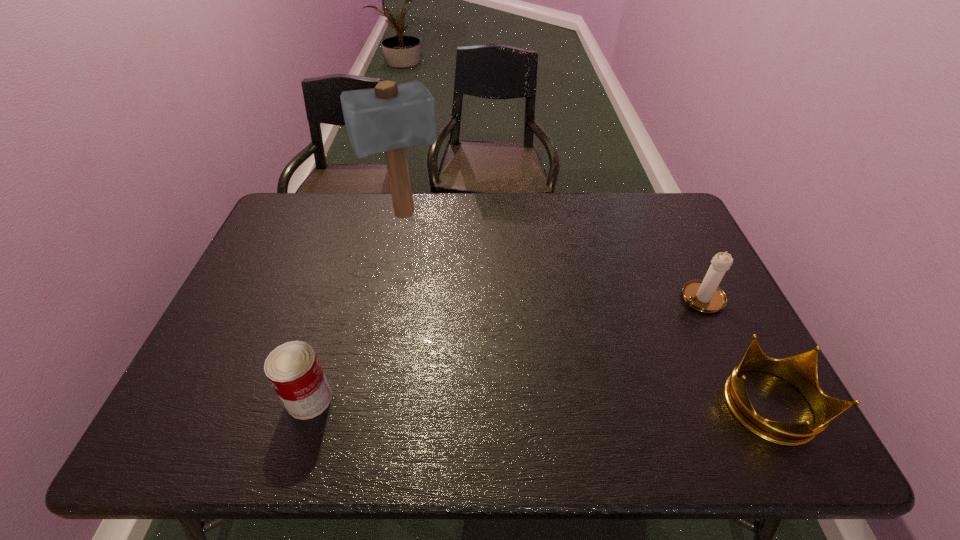
This screenshot has width=960, height=540. Identify the location of unoccupied position between the farthest object and the third nearest object. (552, 257).

Where is `empty space that is in between the farthest object and the crown`? empty space that is in between the farthest object and the crown is located at coordinates (586, 310).

Locate an element on the screen. The width and height of the screenshot is (960, 540). vacant area that lies between the crown and the candle holder is located at coordinates (733, 352).

The height and width of the screenshot is (540, 960). What are the coordinates of `free space that is in between the second farthest object and the shortest object` in the screenshot? It's located at (733, 352).

The image size is (960, 540). Identify the location of free area in between the tallest object and the crown. (586, 310).

You are a GUI agent. You are given a task and a screenshot of the screen. Output one action in this format:
    pyautogui.click(x=<x>, y=<y>)
    Task: Click on the vacant space that is in between the candle holder and the shortest object
    
    Given the screenshot: What is the action you would take?
    pyautogui.click(x=733, y=352)

At what (x,y) coordinates should I click in order to perform the action: click on object that is the third closest to the mallet. Please return your answer as a coordinate pair (x, y). This screenshot has width=960, height=540. Looking at the image, I should click on (800, 370).

Where is `the closest object to the third nearest object`? the closest object to the third nearest object is located at coordinates (800, 370).

Where is `free spot that satisfies the following two spatial constraints: 1. on the front side of the shortest object; 2. on the right side of the third nearest object`? free spot that satisfies the following two spatial constraints: 1. on the front side of the shortest object; 2. on the right side of the third nearest object is located at coordinates (752, 405).

The height and width of the screenshot is (540, 960). Find the location of `vacant region that satisfies the following two spatial constraints: 1. on the front side of the mallet; 2. on the left side of the shortest object`. vacant region that satisfies the following two spatial constraints: 1. on the front side of the mallet; 2. on the left side of the shortest object is located at coordinates (366, 405).